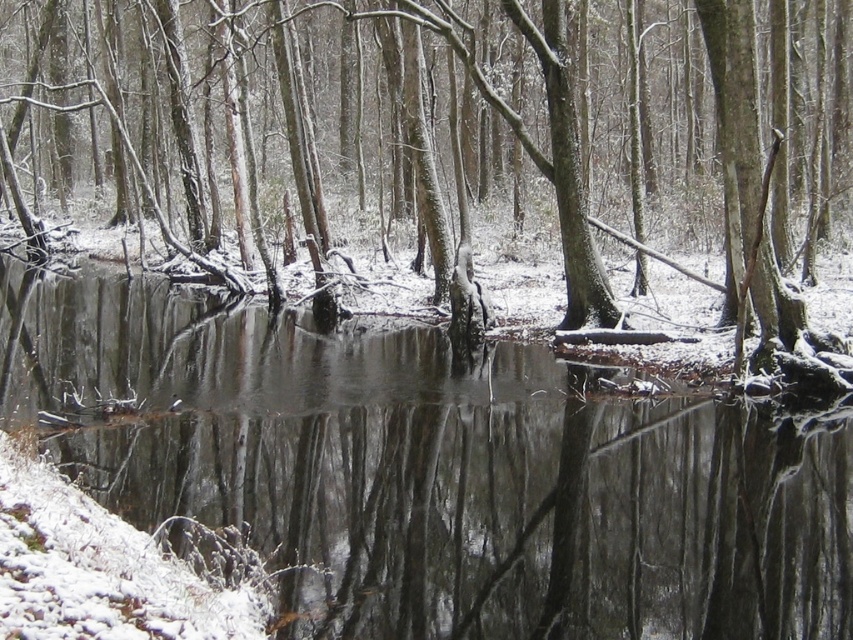
Does clear water at center lie in front of smooth bark tree at center?

Yes.

What do you see at coordinates (439, 474) in the screenshot?
I see `clear water at center` at bounding box center [439, 474].

You are a GUI agent. You are given a task and a screenshot of the screen. Output one action in this format:
    pyautogui.click(x=<x>, y=<y>)
    Task: Click on the clear water at center
    
    Given the screenshot: What is the action you would take?
    pyautogui.click(x=439, y=474)